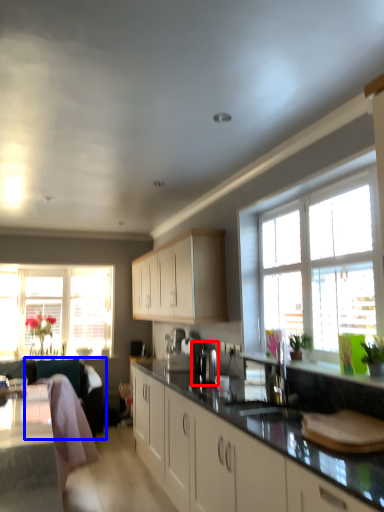
Question: Which object appears farthest to the camera in this image, coffee machine (highlighted by a red box) or swivel chair (highlighted by a blue box)?

Choices:
 (A) coffee machine
 (B) swivel chair

Answer: (B)